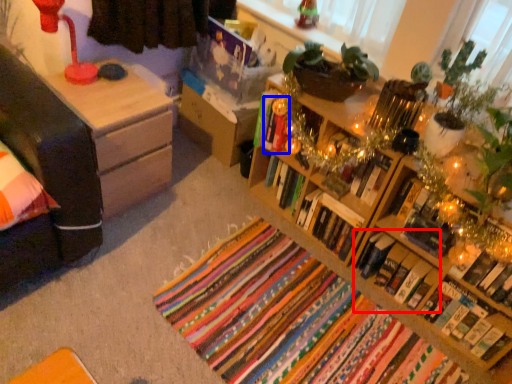
Question: Which object is closer to the camera taking this photo, book (highlighted by a red box) or book (highlighted by a blue box)?

Choices:
 (A) book
 (B) book

Answer: (A)